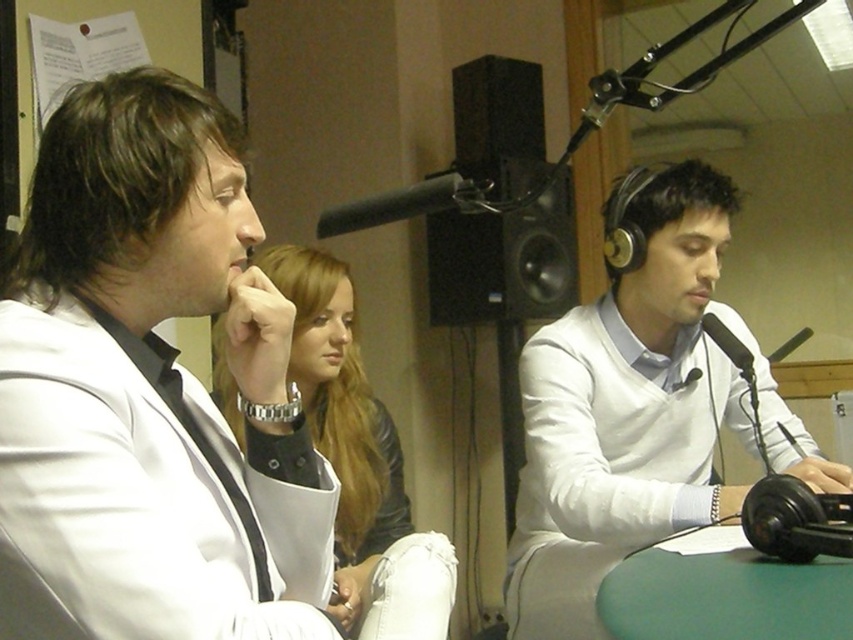
Is green matte table at lower center in front of black matte microphone at upper center?

That is True.

Does green matte table at lower center appear over black matte microphone at upper center?

No, green matte table at lower center is not above black matte microphone at upper center.

Where is `green matte table at lower center`? green matte table at lower center is located at coordinates (724, 595).

How distant is black matte speaker at center from black matte microphone at upper center?

black matte speaker at center is 1.69 meters away from black matte microphone at upper center.

Who is more distant from viewer, (x=517, y=310) or (x=335, y=218)?

The point (x=517, y=310) is behind.

Identify the location of black matte speaker at center. (503, 260).

Which is more to the right, white matte sweater at center or green matte table at lower center?

Positioned to the right is white matte sweater at center.

Locate an element on the screen. The height and width of the screenshot is (640, 853). white matte sweater at center is located at coordinates (637, 413).

You are a GUI agent. You are given a task and a screenshot of the screen. Output one action in this format:
    pyautogui.click(x=<x>, y=<y>)
    Task: Click on the white matte sweater at center
    This screenshot has height=640, width=853.
    Given the screenshot: What is the action you would take?
    pyautogui.click(x=637, y=413)